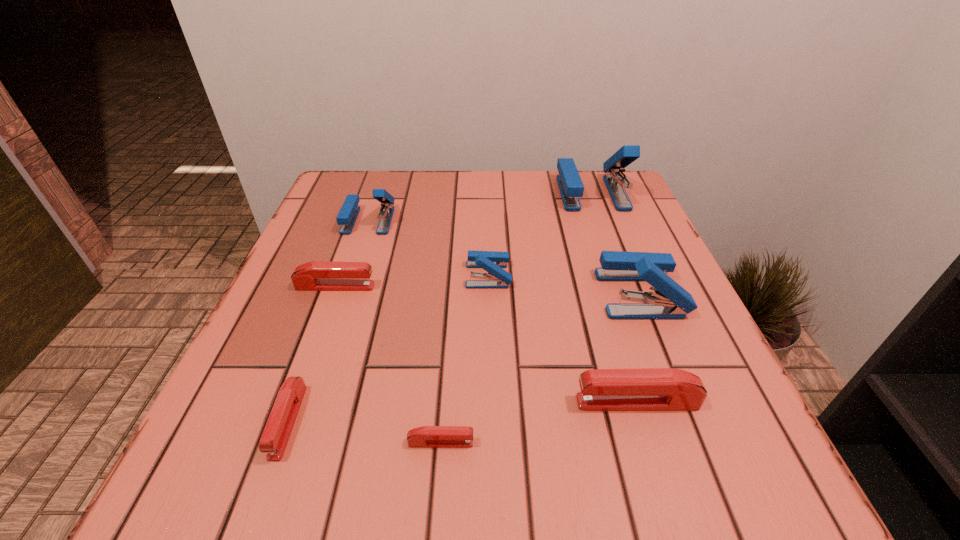
Find the location of a particular element. The height and width of the screenshot is (540, 960). vacant position at the far left corner of the desktop is located at coordinates (319, 212).

Where is `free spot at the near left corner of the desktop`? The height and width of the screenshot is (540, 960). free spot at the near left corner of the desktop is located at coordinates (210, 444).

In the image, there is a desktop. At what (x,y) coordinates should I click in order to perform the action: click on free space at the near right corner. Please return your answer as a coordinate pair (x, y). The height and width of the screenshot is (540, 960). Looking at the image, I should click on (725, 501).

In order to click on free space between the rightmost red stapler and the second tallest object in this screenshot , I will do `click(638, 348)`.

In order to click on empty space that is in between the rightmost red stapler and the second biggest blue stapler in this screenshot , I will do `click(638, 348)`.

This screenshot has width=960, height=540. I want to click on free area in between the second biggest blue stapler and the second smallest red stapler, so click(464, 357).

Identify the location of free point between the tallest object and the shortest object. (516, 318).

Identify the location of vacant area between the smallest red stapler and the second blue stapler from left to right. The width and height of the screenshot is (960, 540). (465, 359).

Identify the location of free spot between the seventh shortest object and the rightmost red stapler. The width and height of the screenshot is (960, 540). (638, 348).

At what (x,y) coordinates should I click in order to perform the action: click on free space between the third biggest red stapler and the second blue stapler from left to right. Please return your answer as a coordinate pair (x, y). This screenshot has width=960, height=540. Looking at the image, I should click on (388, 348).